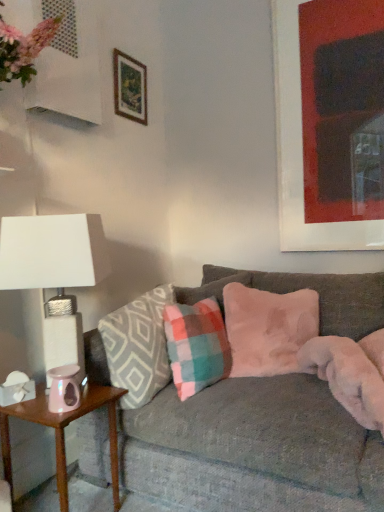
Question: Is iridescent glass candle holder at lower left at the left side of matte black picture frame at upper right, the second picture frame from the left?

Choices:
 (A) yes
 (B) no

Answer: (A)

Question: From the image's perspective, would you say iridescent glass candle holder at lower left is positioned over matte black picture frame at upper right, the second picture frame from the left?

Choices:
 (A) no
 (B) yes

Answer: (A)

Question: Is iridescent glass candle holder at lower left placed right next to matte black picture frame at upper right, which appears as the first picture frame when viewed from the right?

Choices:
 (A) yes
 (B) no

Answer: (B)

Question: From a real-world perspective, does iridescent glass candle holder at lower left stand above matte black picture frame at upper right, the second picture frame from the left?

Choices:
 (A) no
 (B) yes

Answer: (A)

Question: Is iridescent glass candle holder at lower left oriented away from matte black picture frame at upper right, the second picture frame from the left?

Choices:
 (A) yes
 (B) no

Answer: (B)

Question: Is velvet gray couch at center bigger or smaller than plaid fabric pillow at center, acting as the second pillow starting from the right?

Choices:
 (A) big
 (B) small

Answer: (A)

Question: Is velvet gray couch at center inside or outside of plaid fabric pillow at center, which is the second pillow in left-to-right order?

Choices:
 (A) outside
 (B) inside

Answer: (A)

Question: Is velvet gray couch at center to the left or to the right of plaid fabric pillow at center, acting as the second pillow starting from the right, in the image?

Choices:
 (A) right
 (B) left

Answer: (A)

Question: Considering the positions of point (188, 297) and point (200, 306), is point (188, 297) closer or farther from the camera than point (200, 306)?

Choices:
 (A) farther
 (B) closer

Answer: (A)

Question: Is plaid fabric pillow at center, which is the first pillow from left to right, inside the boundaries of matte black picture frame at upper right, which appears as the first picture frame when viewed from the right, or outside?

Choices:
 (A) outside
 (B) inside

Answer: (A)

Question: From the image's perspective, relative to matte black picture frame at upper right, which appears as the first picture frame when viewed from the right, is plaid fabric pillow at center, which is the first pillow from left to right, above or below?

Choices:
 (A) above
 (B) below

Answer: (B)

Question: In the image, is plaid fabric pillow at center, positioned as the 3th pillow in right-to-left order, on the left side or the right side of matte black picture frame at upper right, which appears as the first picture frame when viewed from the right?

Choices:
 (A) right
 (B) left

Answer: (B)

Question: In the image, is plaid fabric pillow at center, which is the first pillow from left to right, positioned in front of or behind matte black picture frame at upper right, which appears as the first picture frame when viewed from the right?

Choices:
 (A) front
 (B) behind

Answer: (A)

Question: Considering their positions, is fuzzy pink pillow at center, the 1th pillow from the right, located in front of or behind plaid fabric pillow at center, which is the second pillow in left-to-right order?

Choices:
 (A) behind
 (B) front

Answer: (A)

Question: Considering the relative positions of fuzzy pink pillow at center, arranged as the third pillow when viewed from the left, and plaid fabric pillow at center, acting as the second pillow starting from the right, in the image provided, is fuzzy pink pillow at center, arranged as the third pillow when viewed from the left, to the left or to the right of plaid fabric pillow at center, acting as the second pillow starting from the right,?

Choices:
 (A) right
 (B) left

Answer: (A)